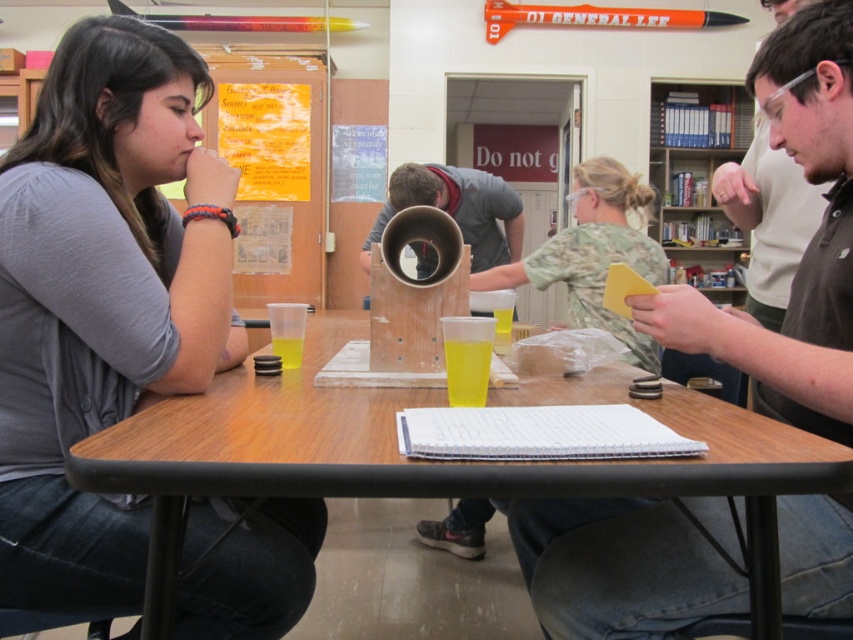
Is yellow translucent cup at table center to the left of translucent plastic cup at table center from the viewer's perspective?

Incorrect, yellow translucent cup at table center is not on the left side of translucent plastic cup at table center.

Which is in front, point (468, 396) or point (294, 346)?

Point (468, 396)

Which is in front, point (473, 376) or point (292, 352)?

Point (473, 376) is in front.

Locate an element on the screen. yellow translucent cup at table center is located at coordinates (467, 371).

Is point (173, 344) more distant than point (469, 396)?

That is True.

Does matte gray shirt at left have a lesser height compared to yellow translucent cup at table center?

Incorrect, matte gray shirt at left's height does not fall short of yellow translucent cup at table center's.

This screenshot has height=640, width=853. In order to click on matte gray shirt at left in this screenshot , I will do `click(103, 296)`.

Can you confirm if matte gray shirt at left is wider than translucent plastic cup at table center?

Indeed, matte gray shirt at left has a greater width compared to translucent plastic cup at table center.

The height and width of the screenshot is (640, 853). Find the location of `matte gray shirt at left`. matte gray shirt at left is located at coordinates point(103,296).